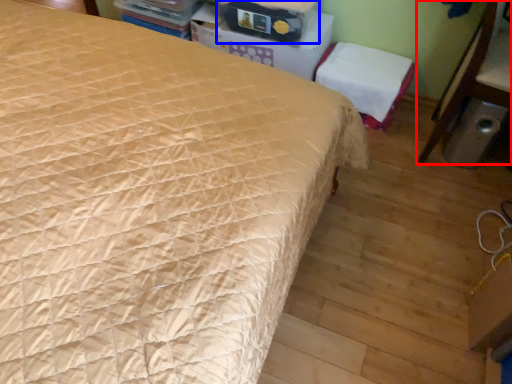
Question: Which of the following is the farthest to the observer, furniture (highlighted by a red box) or storage box (highlighted by a blue box)?

Choices:
 (A) furniture
 (B) storage box

Answer: (B)